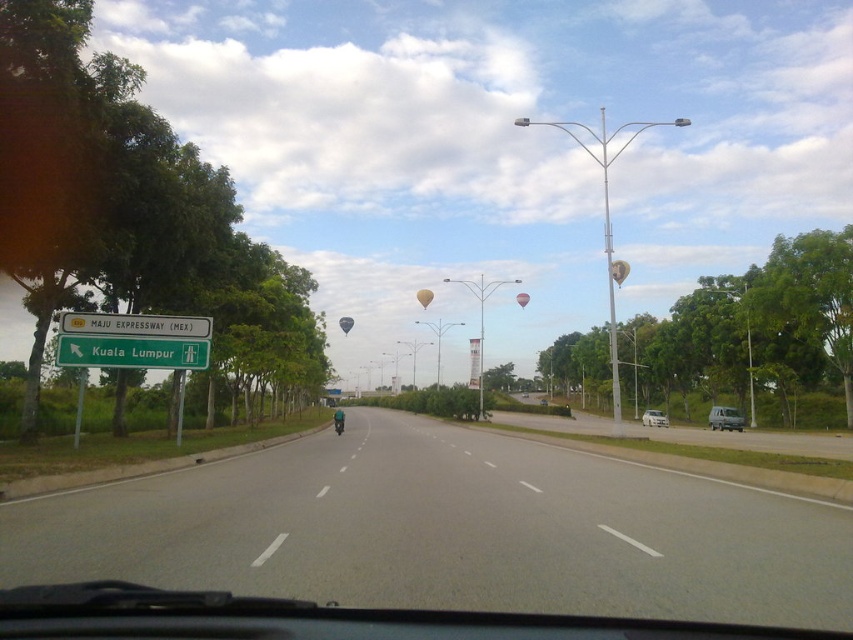
Question: Does green plastic signboard at left have a larger size compared to matte silver suv at right?

Choices:
 (A) no
 (B) yes

Answer: (A)

Question: Does light brown fabric hot air balloon at center lie behind pink fabric balloon at center?

Choices:
 (A) no
 (B) yes

Answer: (B)

Question: Considering the real-world distances, which object is closest to the gray asphalt road at center?

Choices:
 (A) beige fabric balloon at center
 (B) matte silver suv at right
 (C) light brown fabric hot air balloon at center
 (D) silver metallic sedan at center

Answer: (B)

Question: Does yellowmaterial/texturestreet sign at left appear on the right side of beige fabric balloon at center?

Choices:
 (A) no
 (B) yes

Answer: (A)

Question: Which of the following is the farthest from the observer?

Choices:
 (A) (160, 339)
 (B) (520, 296)
 (C) (343, 321)
 (D) (660, 412)

Answer: (D)

Question: Which object appears closest to the camera in this image?

Choices:
 (A) silver metallic sedan at center
 (B) yellowmaterial/texturestreet sign at left

Answer: (B)